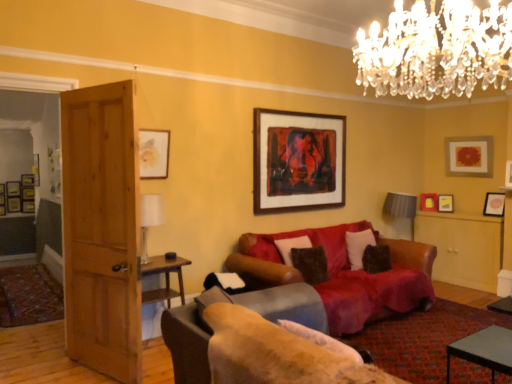
Identify the location of blank space above matte gold picture frame at upper left, marked as the sixth picture frame in a right-to-left arrangement (from a real-world perspective). This screenshot has width=512, height=384. (151, 121).